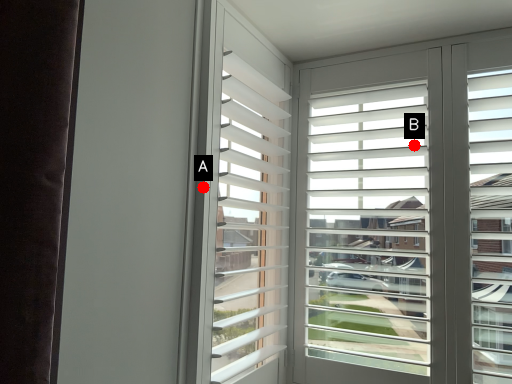
Question: Two points are circled on the image, labeled by A and B beside each circle. Among these points, which one is farthest from the camera?

Choices:
 (A) A is further
 (B) B is further

Answer: (B)